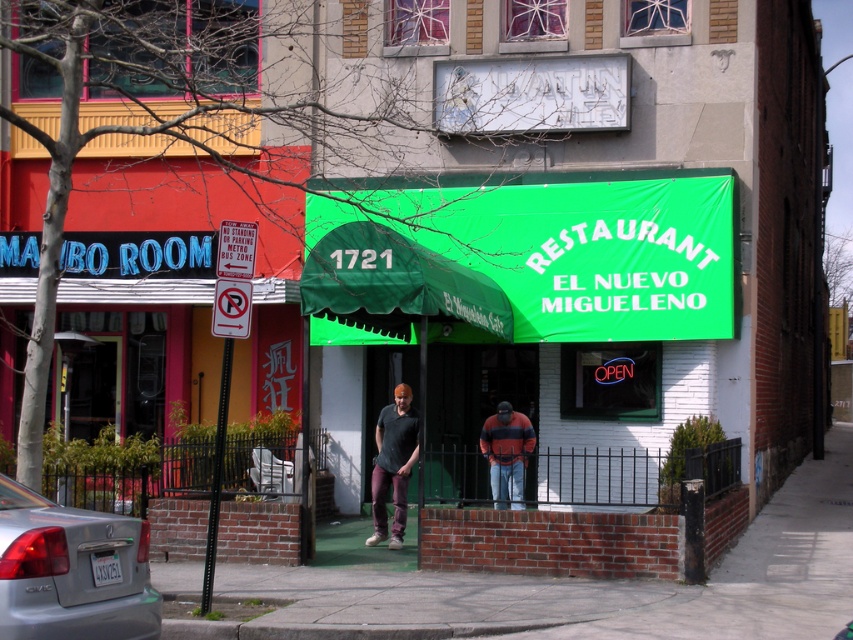
Who is lower down, silver metallic sedan at lower left or striped sweater at center?

striped sweater at center is below.

Describe the element at coordinates (71, 572) in the screenshot. Image resolution: width=853 pixels, height=640 pixels. I see `silver metallic sedan at lower left` at that location.

Where is `silver metallic sedan at lower left`? silver metallic sedan at lower left is located at coordinates (71, 572).

Does point (376, 538) lie in front of point (488, 429)?

That is True.

The image size is (853, 640). Describe the element at coordinates (393, 465) in the screenshot. I see `matte black shirt at center` at that location.

At what (x,y) coordinates should I click in order to perform the action: click on matte black shirt at center. Please return your answer as a coordinate pair (x, y). The height and width of the screenshot is (640, 853). Looking at the image, I should click on (393, 465).

Is green fabric awning at center positioned before striped sweater at center?

No, it is not.

Which is more to the left, green fabric awning at center or striped sweater at center?

green fabric awning at center is more to the left.

Is point (347, 192) closer to camera compared to point (509, 502)?

That is False.

Where is `green fabric awning at center`? The width and height of the screenshot is (853, 640). green fabric awning at center is located at coordinates (567, 250).